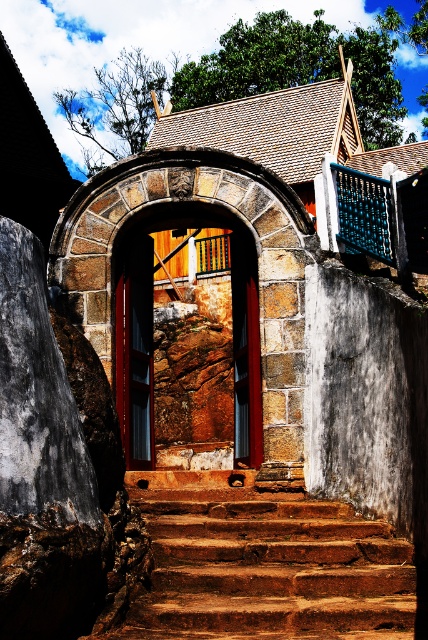
You are standing at the entrance of the temple and want to locate the brown rustic stairs at center. According to the coordinates provided, where would you find them?

The brown rustic stairs at center are located at coordinates point (262,564).

You are standing at the entrance of the temple and want to find the stairs leading to the upper floor. According to the image, where are the brown rustic stairs at center located in relation to the entrance?

The brown rustic stairs at center are located at point 0.883 on the x axis and 0.614 on the y axis, which is to the right and slightly below the entrance.

You are visiting this traditional building and need to enter through the doorway. The brown rustic stairs at center and the matte wood door at center are in your path. Which object will you encounter first as you approach the doorway?

You will encounter the matte wood door at center first because it is closer to the entrance, while the brown rustic stairs at center are further back and larger in size.